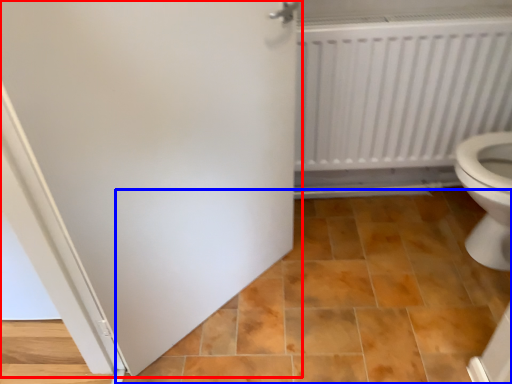
Question: Among these objects, which one is nearest to the camera, door (highlighted by a red box) or ceramic tile (highlighted by a blue box)?

Choices:
 (A) door
 (B) ceramic tile

Answer: (A)